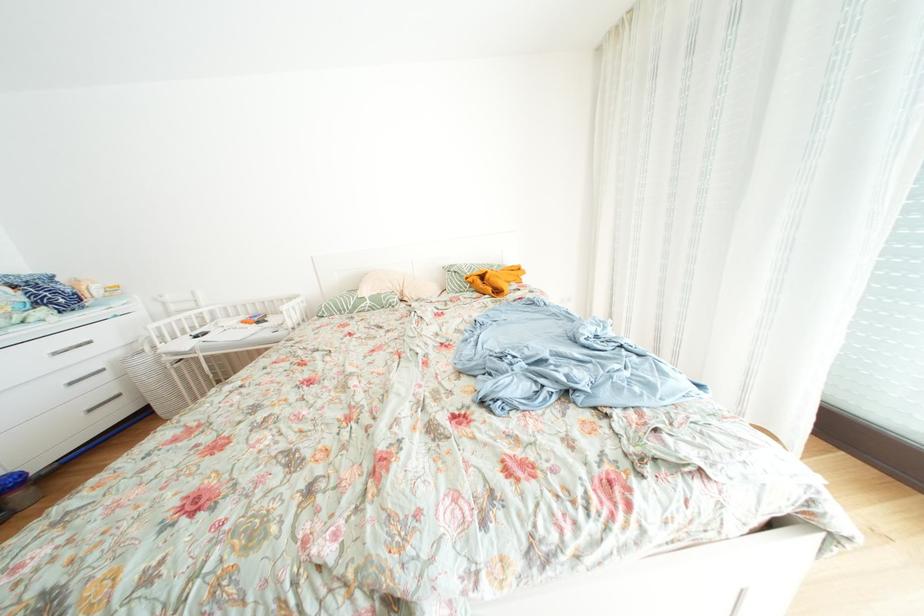
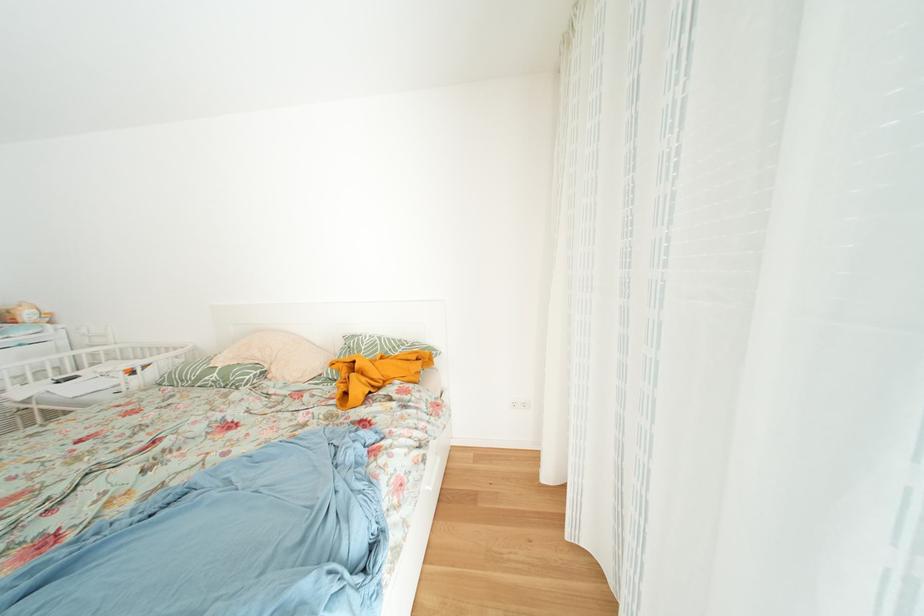
Find the pixel in the second image that matches pixel 363 312 in the first image.

(208, 384)